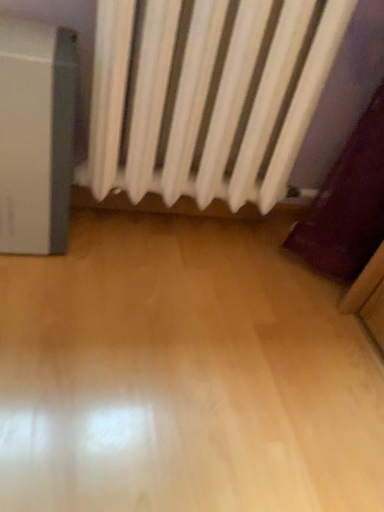
What do you see at coordinates (36, 135) in the screenshot? Image resolution: width=384 pixels, height=512 pixels. I see `satin silver air purifier at left` at bounding box center [36, 135].

Measure the distance between point (46, 105) and camera.

The distance of point (46, 105) from camera is 29.17 inches.

Find the location of a particular element. satin silver air purifier at left is located at coordinates (36, 135).

Locate an element on the screen. white matte radiator at upper center is located at coordinates (206, 97).

Describe the element at coordinates (206, 97) in the screenshot. This screenshot has width=384, height=512. I see `white matte radiator at upper center` at that location.

Identify the location of satin silver air purifier at left. The width and height of the screenshot is (384, 512). (36, 135).

Does satin silver air purifier at left appear on the left side of white matte radiator at upper center?

Yes.

Considering the positions of objects satin silver air purifier at left and white matte radiator at upper center in the image provided, who is in front, satin silver air purifier at left or white matte radiator at upper center?

Positioned in front is white matte radiator at upper center.

Does point (19, 228) appear closer or farther from the camera than point (209, 134)?

Point (19, 228) appears to be farther away from the viewer than point (209, 134).

From the image's perspective, does satin silver air purifier at left appear higher than white matte radiator at upper center?

Actually, satin silver air purifier at left appears below white matte radiator at upper center in the image.

From a real-world perspective, who is located higher, satin silver air purifier at left or white matte radiator at upper center?

From a 3D spatial view, white matte radiator at upper center is above.

Which of these two, satin silver air purifier at left or white matte radiator at upper center, is thinner?

white matte radiator at upper center.

Which of these two, satin silver air purifier at left or white matte radiator at upper center, stands shorter?

satin silver air purifier at left is shorter.

Considering the sizes of satin silver air purifier at left and white matte radiator at upper center in the image, is satin silver air purifier at left bigger or smaller than white matte radiator at upper center?

Considering their sizes, satin silver air purifier at left takes up less space than white matte radiator at upper center.

Do you think satin silver air purifier at left is within white matte radiator at upper center, or outside of it?

satin silver air purifier at left is not inside white matte radiator at upper center, it's outside.

Is satin silver air purifier at left not near white matte radiator at upper center?

No.

Is satin silver air purifier at left looking in the opposite direction of white matte radiator at upper center?

No, satin silver air purifier at left's orientation is not away from white matte radiator at upper center.

How distant is satin silver air purifier at left from white matte radiator at upper center?

9.27 inches.

The height and width of the screenshot is (512, 384). I want to click on curtain to the right of satin silver air purifier at left, so click(206, 97).

Considering the relative positions of white matte radiator at upper center and satin silver air purifier at left in the image provided, is white matte radiator at upper center to the right of satin silver air purifier at left from the viewer's perspective?

Indeed, white matte radiator at upper center is positioned on the right side of satin silver air purifier at left.

In the scene shown: Considering the positions of objects white matte radiator at upper center and satin silver air purifier at left in the image provided, who is in front, white matte radiator at upper center or satin silver air purifier at left?

white matte radiator at upper center is more forward.

Is point (262, 198) positioned before point (46, 62)?

No, it is not.

From the image's perspective, would you say white matte radiator at upper center is shown under satin silver air purifier at left?

No.

From a real-world perspective, which object rests below the other?

In real-world perspective, satin silver air purifier at left is lower.

Considering the relative sizes of white matte radiator at upper center and satin silver air purifier at left in the image provided, is white matte radiator at upper center thinner than satin silver air purifier at left?

Indeed, white matte radiator at upper center has a lesser width compared to satin silver air purifier at left.

Who is taller, white matte radiator at upper center or satin silver air purifier at left?

white matte radiator at upper center.

Based on the photo, which of these two, white matte radiator at upper center or satin silver air purifier at left, is smaller?

Smaller between the two is satin silver air purifier at left.

Is satin silver air purifier at left a part of white matte radiator at upper center?

No, white matte radiator at upper center does not contain satin silver air purifier at left.

Looking at this image, is white matte radiator at upper center touching satin silver air purifier at left?

white matte radiator at upper center and satin silver air purifier at left are not in contact.

Is satin silver air purifier at left at the back of white matte radiator at upper center?

white matte radiator at upper center is not turned away from satin silver air purifier at left.

How many degrees apart are the facing directions of white matte radiator at upper center and satin silver air purifier at left?

0.000294 degrees separate the facing orientations of white matte radiator at upper center and satin silver air purifier at left.

Where is `appliance on the left of white matte radiator at upper center`? appliance on the left of white matte radiator at upper center is located at coordinates (36, 135).

Find the location of `curtain that appears above the satin silver air purifier at left (from the image's perspective)`. curtain that appears above the satin silver air purifier at left (from the image's perspective) is located at coordinates (206, 97).

The height and width of the screenshot is (512, 384). What are the coordinates of `curtain in front of the satin silver air purifier at left` in the screenshot? It's located at (206, 97).